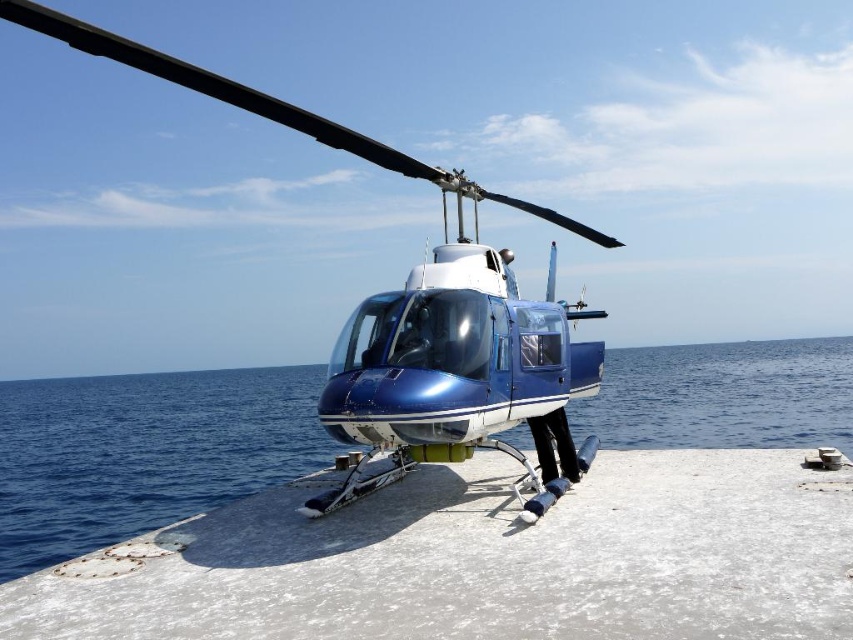
Looking at this image, you are standing at the point closest to the helicopter. There are two points marked in the image, one at coordinates point (x=218, y=442) and the other at point (x=511, y=202). Which point is farther away from you?

Point (x=218, y=442) is behind point (x=511, y=202), so it is farther away from you.

You are standing at the point marked by the coordinates point [482,561] and want to walk towards the helicopter. Is the helicopter located to your left or right side?

The helicopter is located to the right side of the point [482,561].

You are a pilot who needs to refuel the metallic blue helicopter at center. The fuel station is located on the blue glossy water at center. Which direction should you go from the helicopter to reach the fuel station?

The blue glossy water at center is positioned on the right side of metallic blue helicopter at center, so you should go to the right side to reach the fuel station.